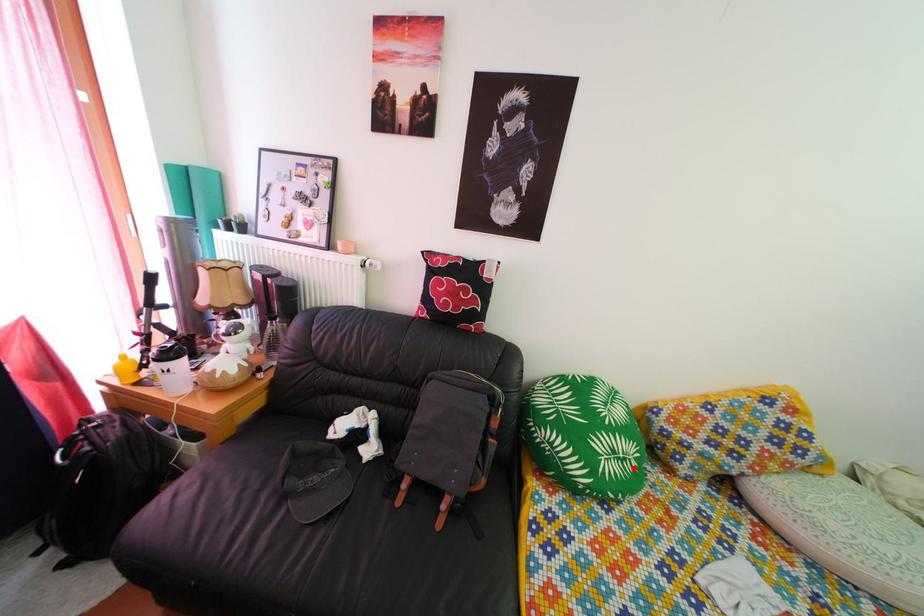
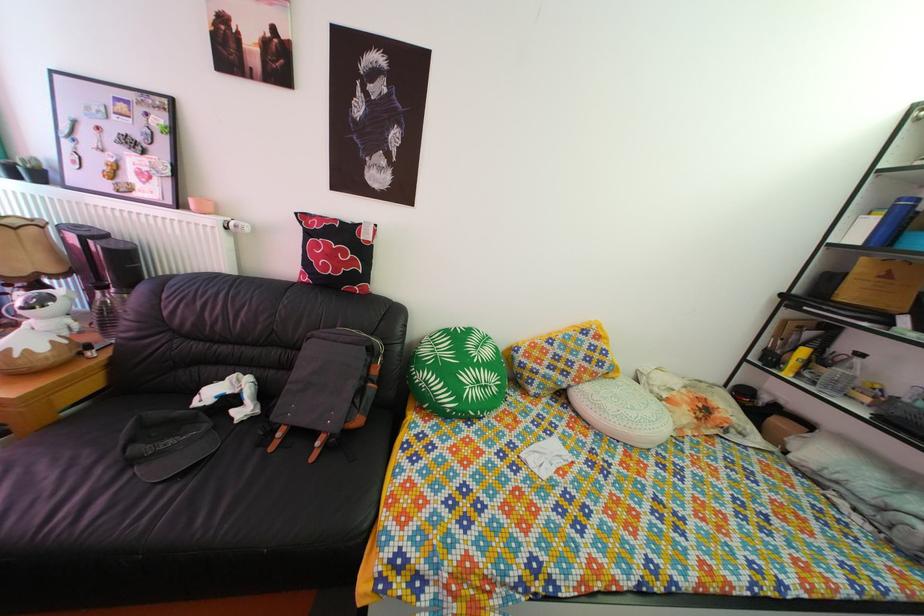
Locate, in the second image, the point that corresponds to the highlighted location in the first image.

(494, 395)